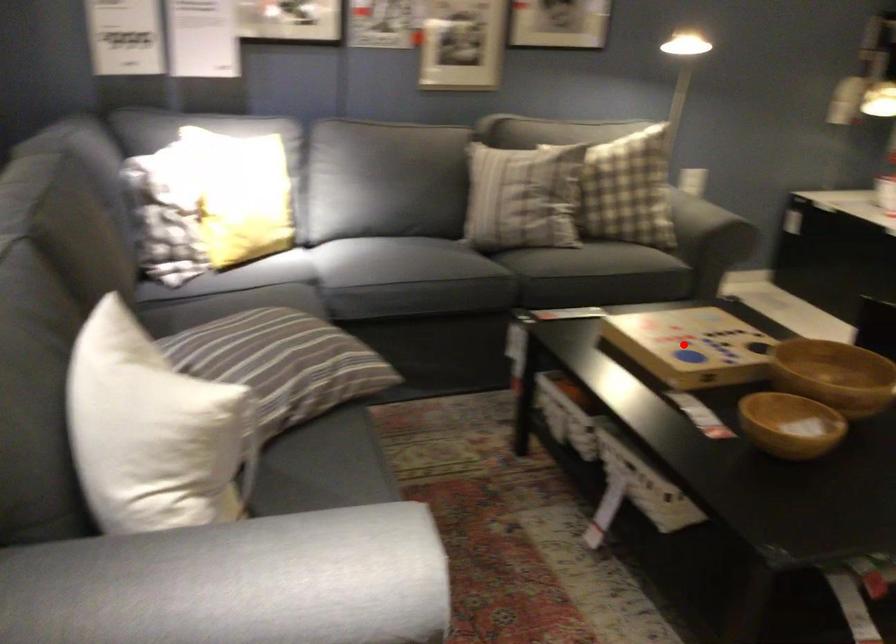
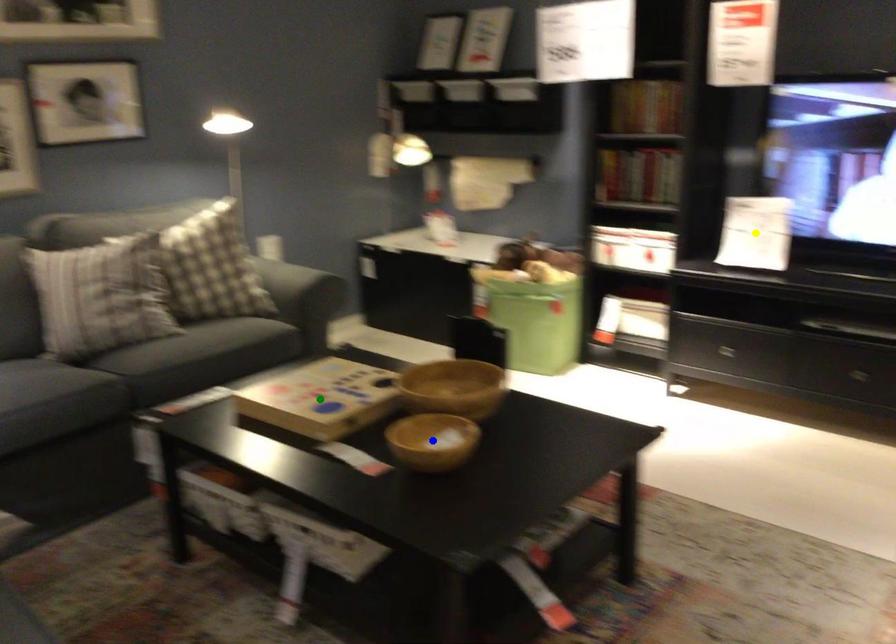
Question: I am providing you with two images of the same scene from different viewpoints. A red point is marked on the first image. You are given multiple points on the second image. Which spot in image 2 lines up with the point in image 1?

Choices:
 (A) green point
 (B) blue point
 (C) yellow point

Answer: (A)